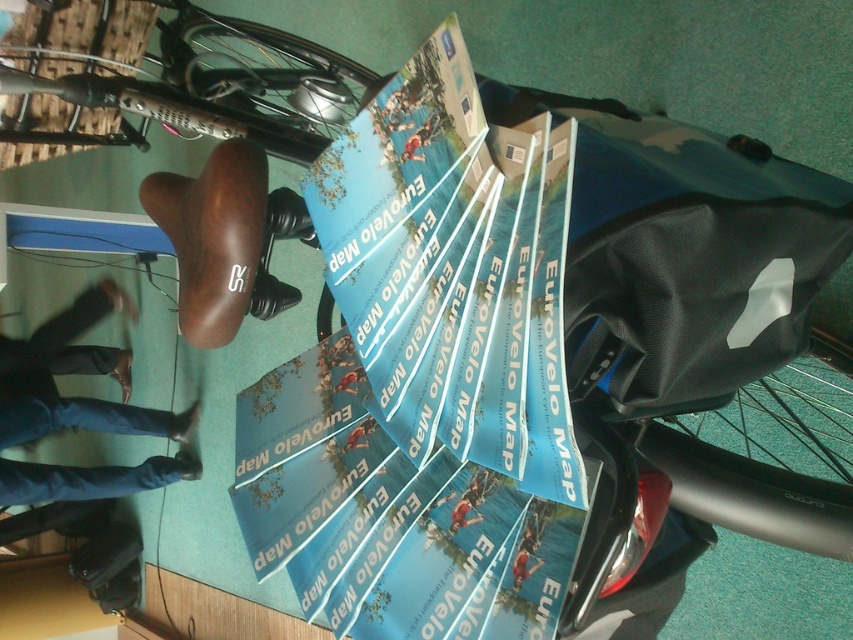
You are organizing a cycling event and need to pack promotional materials. You have a matte black bag at center and a blue fabric map at center. Which item can hold more items inside?

The matte black bag at center has a larger size compared to the blue fabric map at center, so it can hold more items inside.

You are organizing a cycling event and have a matte black bag at center and a blue paper map at center on a table. You need to place a 12 inch ruler between them. Will the ruler fit between the two items?

The matte black bag at center and blue paper map at center are 16.61 inches apart. Since the ruler is 12 inches long, it will fit between them as the distance is greater than the ruler.